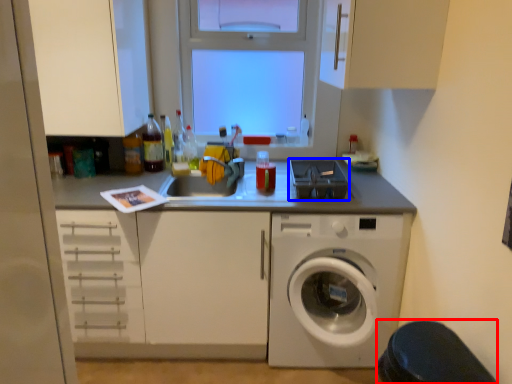
Question: Which object is further to the camera taking this photo, step stool (highlighted by a red box) or appliance (highlighted by a blue box)?

Choices:
 (A) step stool
 (B) appliance

Answer: (B)